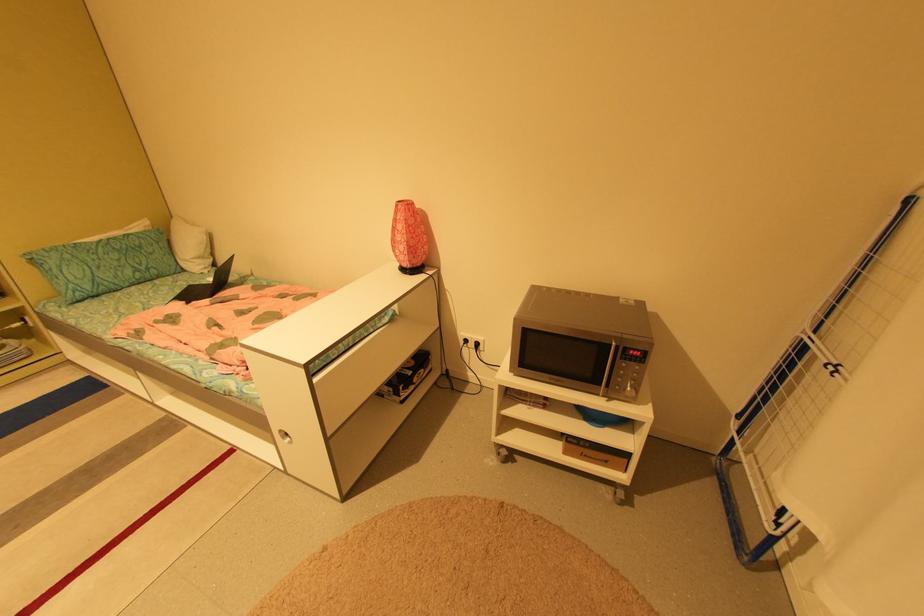
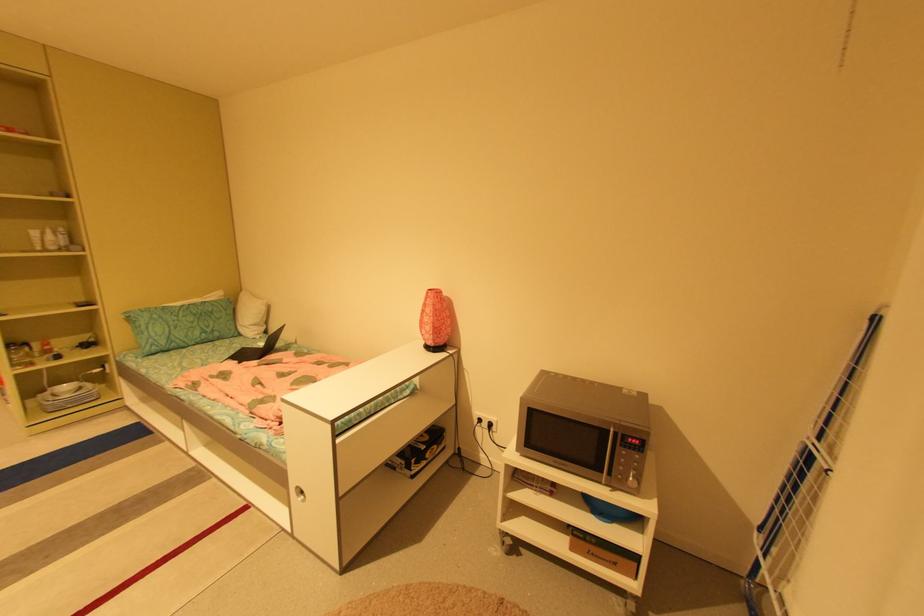
Question: Which direction would the cameraman need to move to produce the second image? Reply with the corresponding letter.

Choices:
 (A) Left
 (B) Right
 (C) Forward
 (D) Backward

Answer: (D)